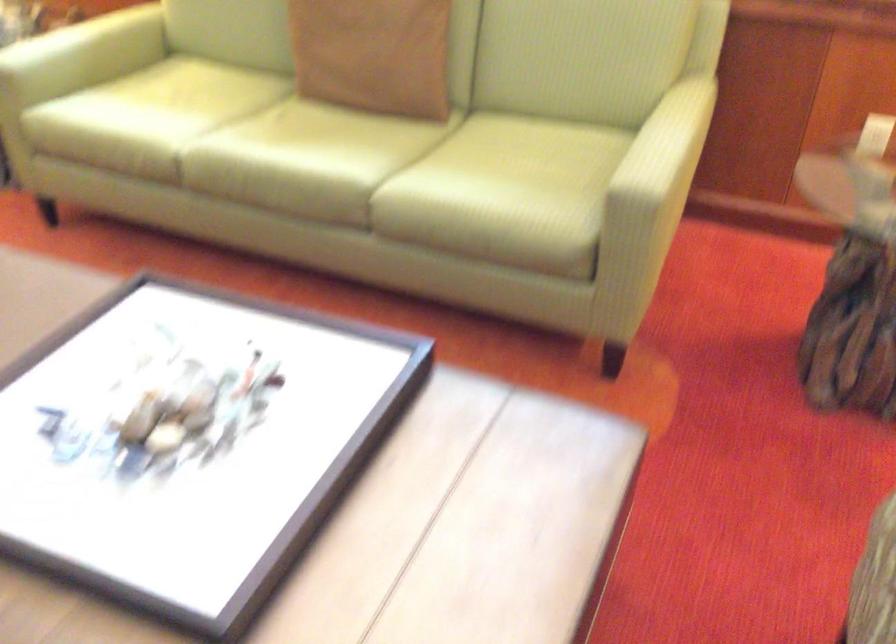
The image size is (896, 644). What do you see at coordinates (429, 182) in the screenshot?
I see `a sofa sitting surface` at bounding box center [429, 182].